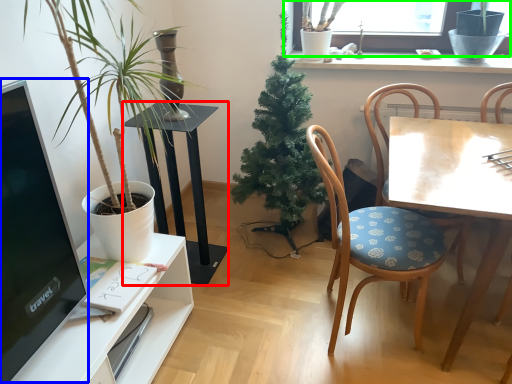
Question: Which object is positioned farthest from table (highlighted by a red box)? Select from computer monitor (highlighted by a blue box) and window (highlighted by a green box).

Choices:
 (A) computer monitor
 (B) window

Answer: (B)